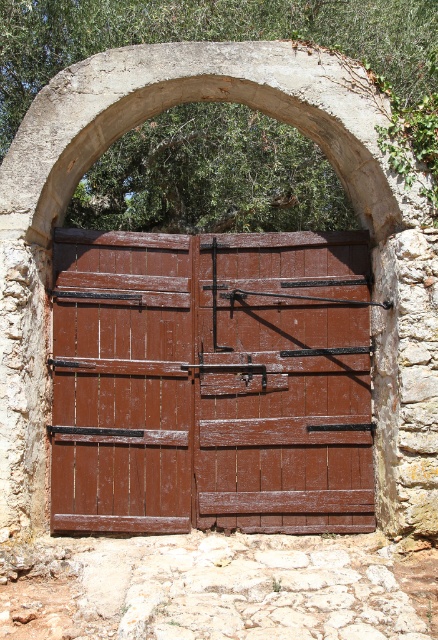
You are standing in front of the rustic wooden gate within the stone archway. You notice two points marked on the gate. One is at coordinate point (211, 360) and the other at point (77, 432). From your perspective, which point is closer to you?

Point (77, 432) is closer to you because it is in front of point (211, 360).